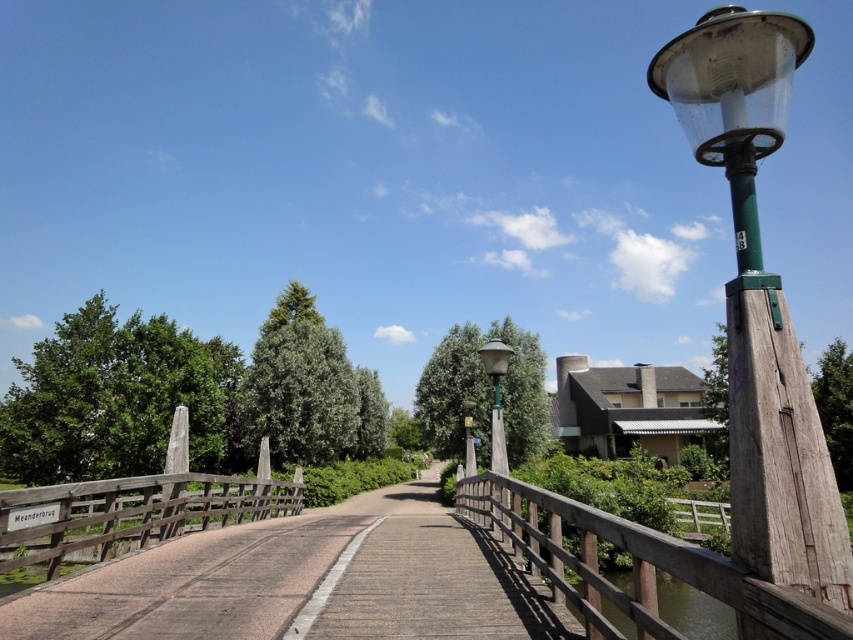
You are a painter planning to sketch this scene. You want to ensure the wooden bridge at right and the green matte street light at center are proportionally accurate. Which object should you draw first to maintain scale, and why?

You should draw the wooden bridge at right first because it is larger in size than the green matte street light at center, so starting with the larger object ensures proper scaling for the smaller one.